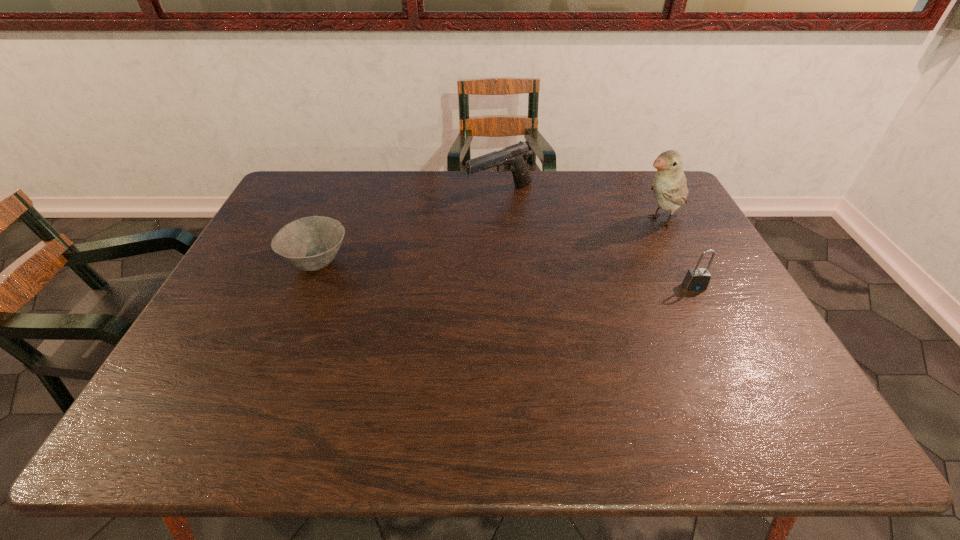
Locate an element on the screen. Image resolution: width=960 pixels, height=540 pixels. the leftmost object is located at coordinates (310, 243).

You are a GUI agent. You are given a task and a screenshot of the screen. Output one action in this format:
    pyautogui.click(x=<x>, y=<y>)
    Task: Click on the bowl
    This screenshot has height=540, width=960.
    Given the screenshot: What is the action you would take?
    pyautogui.click(x=310, y=243)

Locate an element on the screen. the third tallest object is located at coordinates click(x=697, y=279).

Find the location of `the second farthest object`. the second farthest object is located at coordinates (669, 186).

This screenshot has height=540, width=960. I want to click on the tallest object, so click(x=669, y=186).

You are a GUI agent. You are given a task and a screenshot of the screen. Output one action in this format:
    pyautogui.click(x=<x>, y=<y>)
    Task: Click on the gun
    This screenshot has width=960, height=540.
    Given the screenshot: What is the action you would take?
    pyautogui.click(x=514, y=158)

You are a GUI agent. You are given a task and a screenshot of the screen. Output one action in this format:
    pyautogui.click(x=<x>, y=<y>)
    Task: Click on the second tallest object
    The height and width of the screenshot is (540, 960).
    Given the screenshot: What is the action you would take?
    pyautogui.click(x=514, y=158)

Locate an element on the screen. The width and height of the screenshot is (960, 540). free location located 0.320m on the front of the shortest object is located at coordinates (265, 388).

Where is `blank space located 0.130m on the shackle of the second shortest object`? The width and height of the screenshot is (960, 540). blank space located 0.130m on the shackle of the second shortest object is located at coordinates 716,329.

Locate an element on the screen. The height and width of the screenshot is (540, 960). vacant area situated at the face of the tallest object is located at coordinates (587, 251).